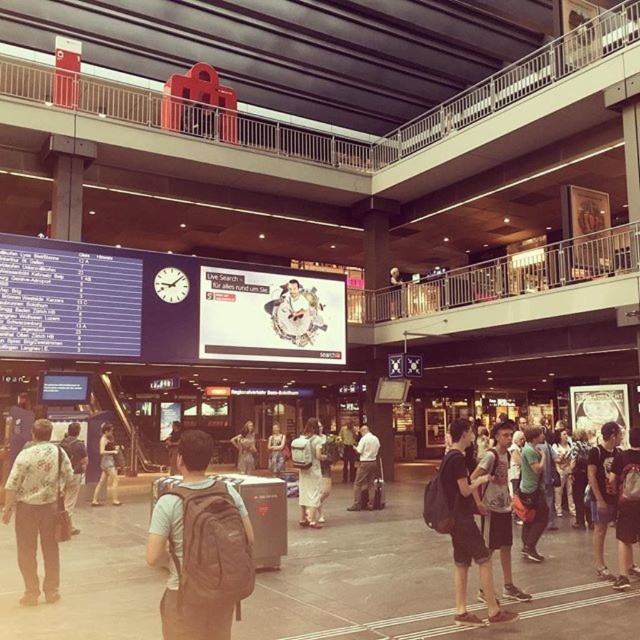
Question: Which point is closer to the camera taking this photo?

Choices:
 (A) (74, 426)
 (B) (451, 497)
 (C) (168, 580)

Answer: (C)

Question: Is matte gray backpack at center wider than dark brown leather backpack at center?

Choices:
 (A) yes
 (B) no

Answer: (A)

Question: Is dark brown leather backpack at center below denim shorts at center?

Choices:
 (A) no
 (B) yes

Answer: (A)

Question: Is light gray backpack at center to the left of light brown fabric dress at center from the viewer's perspective?

Choices:
 (A) yes
 (B) no

Answer: (B)

Question: Which object appears farthest from the camera in this image?

Choices:
 (A) white cotton dress at center
 (B) denim shorts at center
 (C) floral shirt at left
 (D) matte gray backpack at center

Answer: (B)

Question: Which of the following is the farthest from the observer?

Choices:
 (A) light brown fabric dress at center
 (B) floral shirt at center
 (C) light gray backpack at center
 (D) dark brown leather backpack at center

Answer: (A)